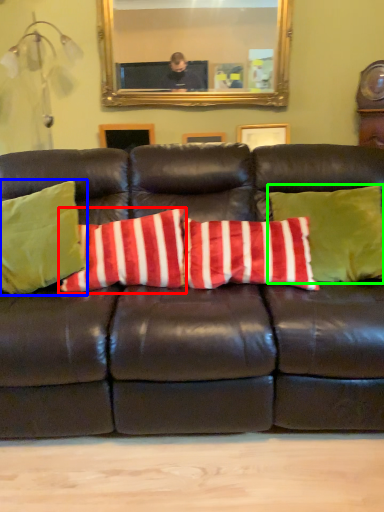
Question: Which is nearer to the pillow (highlighted by a red box)? pillow (highlighted by a blue box) or pillow (highlighted by a green box).

Choices:
 (A) pillow
 (B) pillow

Answer: (A)